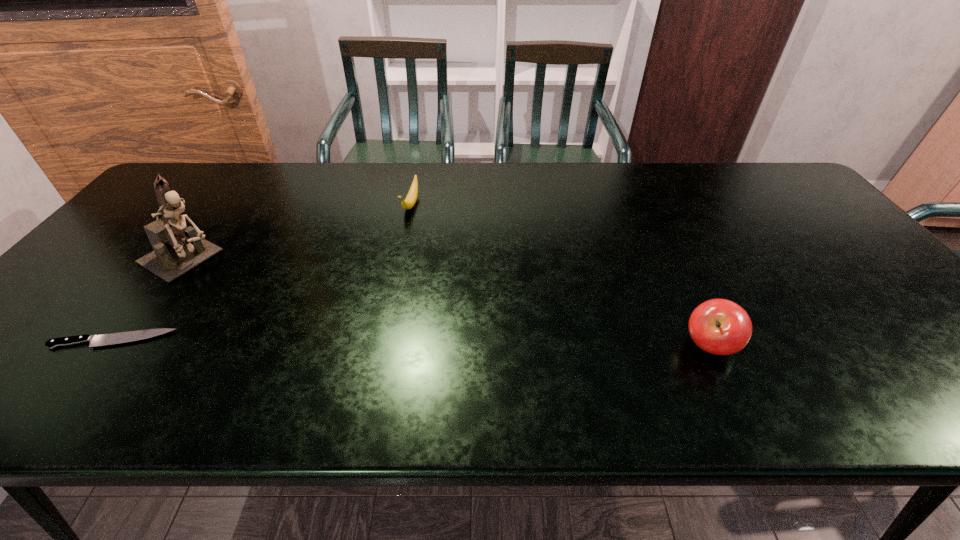
This screenshot has width=960, height=540. I want to click on vacant space located 0.130m on the stem of the apple, so click(x=623, y=346).

The width and height of the screenshot is (960, 540). Find the location of `vacant space situated 0.350m on the front-facing side of the figurine`. vacant space situated 0.350m on the front-facing side of the figurine is located at coordinates (315, 325).

Locate an element on the screen. vacant space located 0.340m on the front-facing side of the figurine is located at coordinates (312, 323).

Locate an element on the screen. free location located 0.380m on the front-facing side of the figurine is located at coordinates 324,330.

The image size is (960, 540). I want to click on free space located at the stem of the banana, so click(389, 264).

The height and width of the screenshot is (540, 960). Find the location of `vacant position located 0.350m at the stem of the banana`. vacant position located 0.350m at the stem of the banana is located at coordinates (370, 308).

The image size is (960, 540). Identify the location of free space located 0.390m at the stem of the banana. (364, 321).

Image resolution: width=960 pixels, height=540 pixels. In order to click on object present at the far edge in this screenshot , I will do `click(409, 202)`.

The image size is (960, 540). I want to click on steak knife that is at the near edge, so click(x=114, y=338).

Where is `apple that is positioned at the near edge`? The width and height of the screenshot is (960, 540). apple that is positioned at the near edge is located at coordinates (718, 326).